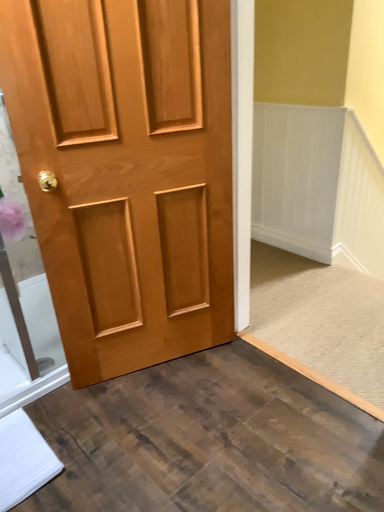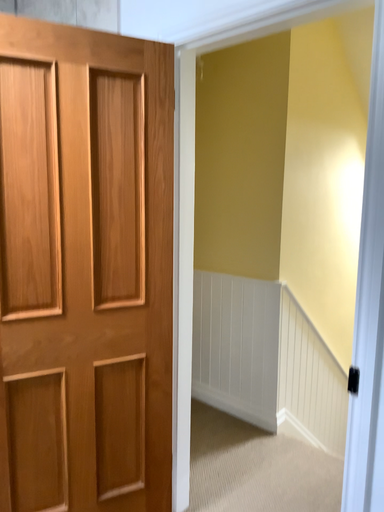
Question: Which way did the camera rotate in the video?

Choices:
 (A) rotated upward
 (B) rotated downward

Answer: (A)